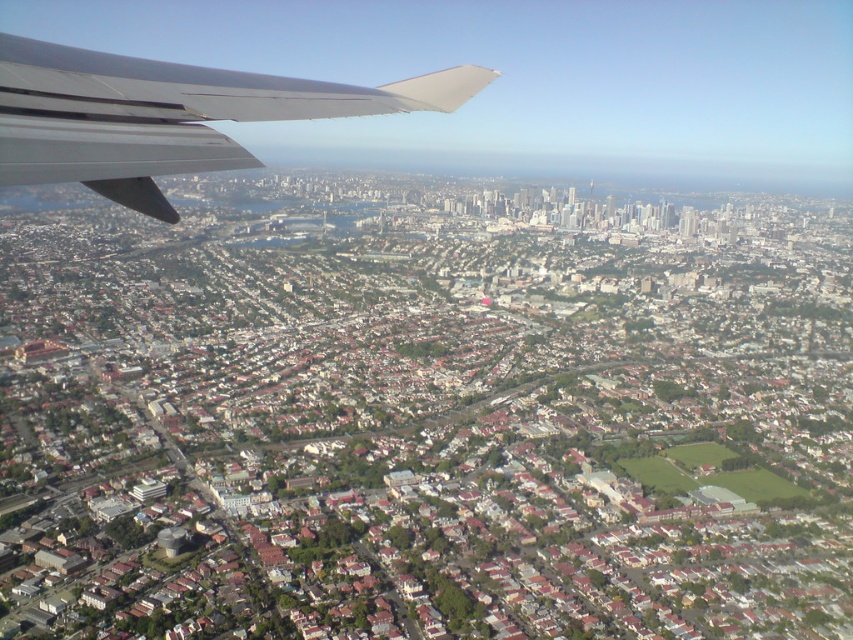
You are a drone operator trying to capture a photo of the city from above. Your drone is currently at the position of the metallic gray wing at upper left. To avoid collision with the wing, you need to fly your drone to the right. In which direction should you move the drone relative to the city to stay clear of the wing?

Since the metallic gray wing at upper left is located at point (167, 115), moving the drone to the right would mean shifting its position towards the city center or the downtown area where the high rise buildings are located. This direction keeps the drone away from the wing.

You are a pilot looking at the view from the cockpit window. You notice two wings visible in the scene. Which wing, the metallic gray wing at upper left or the matte gray wing at upper left, is closer to you?

The metallic gray wing at upper left is closer to the viewer than the matte gray wing at upper left according to the description.

You are a pilot looking at the view from the cockpit window. You notice two wings, the metallic gray wing at upper left and the matte gray wing at upper left. Which one is positioned to the right when observing from your cockpit seat?

The metallic gray wing at upper left is positioned to the right of the matte gray wing at upper left when observing from the cockpit seat.